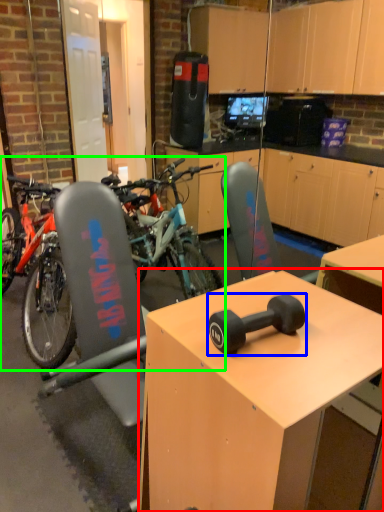
Question: Which object is the farthest from desk (highlighted by a red box)? Choose among these: dumbbell (highlighted by a blue box) or mountain bike (highlighted by a green box).

Choices:
 (A) dumbbell
 (B) mountain bike

Answer: (B)